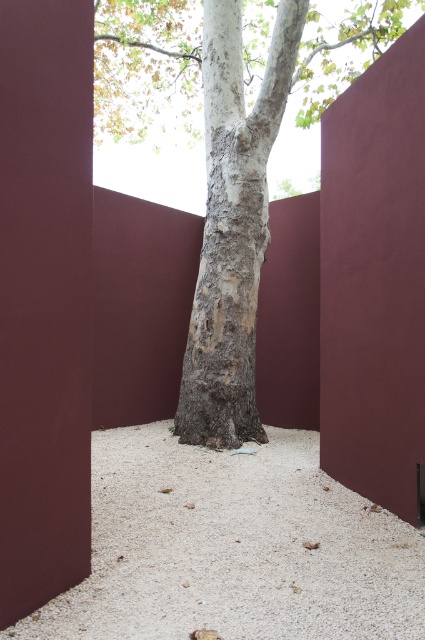
Who is higher up, white gravel at center or gray textured bark at center?

gray textured bark at center is higher up.

Is white gravel at center bigger than gray textured bark at center?

No.

Find the location of a particular element. white gravel at center is located at coordinates (232, 547).

Is white gravel at center behind smooth bark tree at center?

No.

Who is more distant from viewer, [178,625] or [314,10]?

The point [314,10] is more distant.

You are a GUI agent. You are given a task and a screenshot of the screen. Output one action in this format:
    pyautogui.click(x=<x>, y=<y>)
    Task: Click on the white gravel at center
    This screenshot has width=425, height=640.
    Given the screenshot: What is the action you would take?
    pyautogui.click(x=232, y=547)

Between gray textured bark at center and smooth bark tree at center, which one appears on the left side from the viewer's perspective?

gray textured bark at center

Can you confirm if gray textured bark at center is smaller than smooth bark tree at center?

No, gray textured bark at center is not smaller than smooth bark tree at center.

Identify the location of gray textured bark at center. (232, 225).

Locate an element on the screen. The image size is (425, 640). gray textured bark at center is located at coordinates (232, 225).